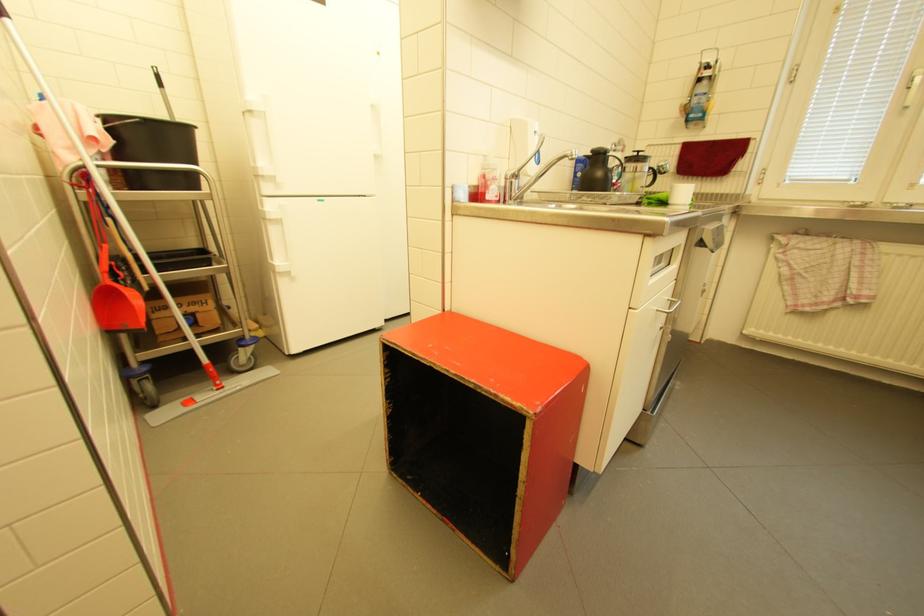
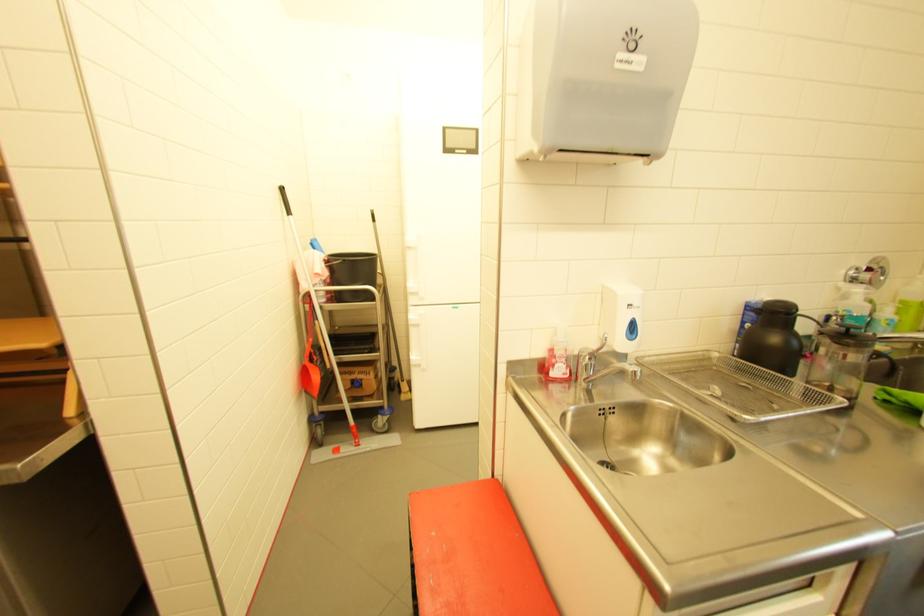
In the second image, find the point that corresponds to point (285, 270) in the first image.

(419, 363)